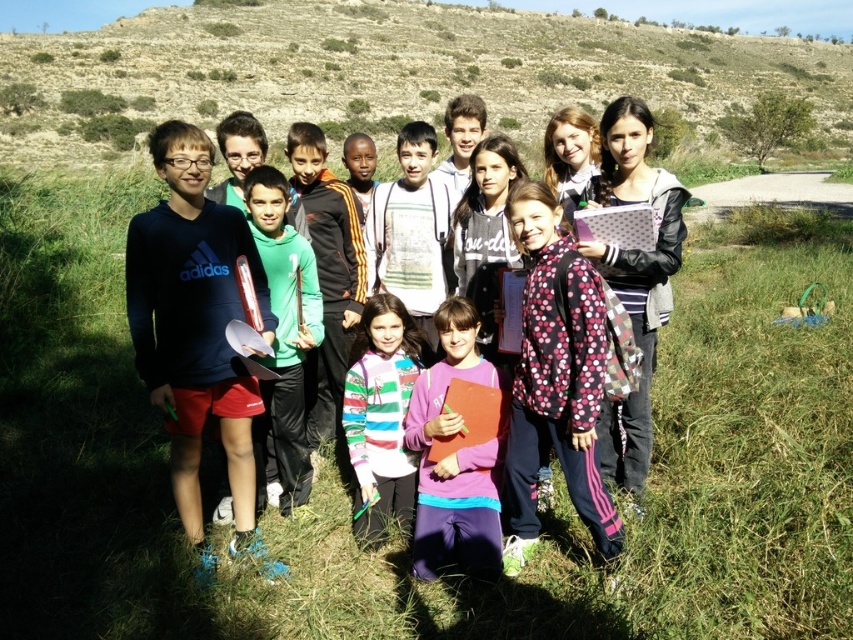
You are a photographer who needs to adjust the lighting for the children in the photo. The pink polka dot scarf at center and the striped sweater at center are both in the frame. Which object should you focus on to ensure proper exposure since it is taller?

The pink polka dot scarf at center is much taller than the striped sweater at center, so you should focus on the pink polka dot scarf at center to ensure proper exposure.

You are standing in the grassy area with the children and want to place a small flag at the point closer to you between point (647, 380) and point (401, 461). Which point should you choose?

You should choose point (647, 380) because it is closer to the viewer than point (401, 461).

Looking at this image, you are a photographer trying to capture a closeup shot of the pink polka dot scarf at center while also including the pink dotted jacket at center in the frame. Given the distance between them, is it possible to fit both into the same photo without moving either object?

The pink dotted jacket at center is 35.85 inches away from the pink polka dot scarf at center. Depending on the camera lens and zoom level, it may be possible to capture both in the same frame without moving them, but the exact feasibility depends on the camera equipment used.